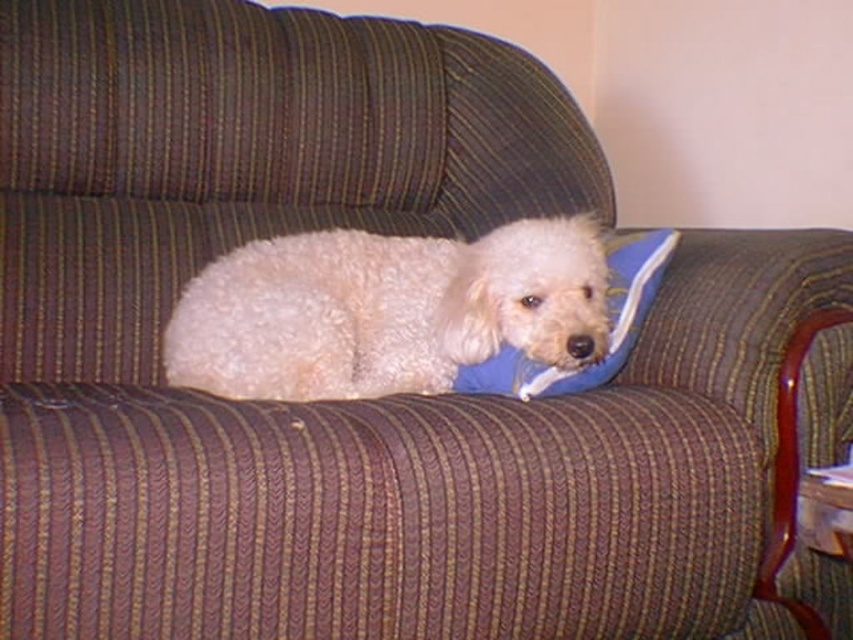
Question: Which object is closer to the camera taking this photo?

Choices:
 (A) white fluffy dog at center
 (B) blue fabric pillow at center

Answer: (A)

Question: Among these points, which one is nearest to the camera?

Choices:
 (A) (511, 291)
 (B) (639, 289)

Answer: (A)

Question: Does white fluffy dog at center come in front of blue fabric pillow at center?

Choices:
 (A) no
 (B) yes

Answer: (B)

Question: Which point is farther to the camera?

Choices:
 (A) white fluffy dog at center
 (B) blue fabric pillow at center

Answer: (B)

Question: Is white fluffy dog at center smaller than blue fabric pillow at center?

Choices:
 (A) no
 (B) yes

Answer: (A)

Question: Can you confirm if white fluffy dog at center is bigger than blue fabric pillow at center?

Choices:
 (A) yes
 (B) no

Answer: (A)